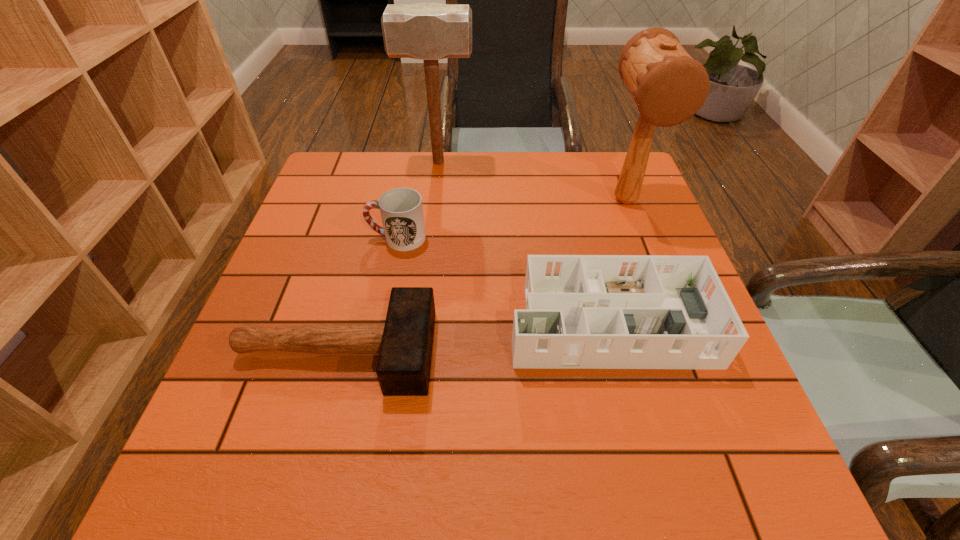
This screenshot has width=960, height=540. In order to click on the farthest object in this screenshot , I will do `click(426, 31)`.

What are the coordinates of `the rightmost mallet` in the screenshot? It's located at (668, 86).

Find the location of `cup`. cup is located at coordinates pyautogui.click(x=401, y=209).

Where is `dollhouse`? This screenshot has height=540, width=960. dollhouse is located at coordinates (582, 311).

Locate an element on the screen. the shortest object is located at coordinates (404, 343).

Image resolution: width=960 pixels, height=540 pixels. In order to click on the nearest mallet in this screenshot , I will do `click(404, 343)`.

You are a GUI agent. You are given a task and a screenshot of the screen. Output one action in this format:
    pyautogui.click(x=<x>, y=<y>)
    Task: Click on the free space located 0.330m on the striking face of the farthest object
    
    Given the screenshot: What is the action you would take?
    click(x=584, y=163)

Find the location of a particular element. The image size is (960, 540). free space located 0.240m on the strike surface of the rightmost mallet is located at coordinates (663, 299).

The height and width of the screenshot is (540, 960). What are the coordinates of `vacant space located on the side of the cup where the handle is located` in the screenshot? It's located at (336, 238).

This screenshot has height=540, width=960. What are the coordinates of `free space located on the side of the cup where the handle is located` in the screenshot? It's located at (300, 238).